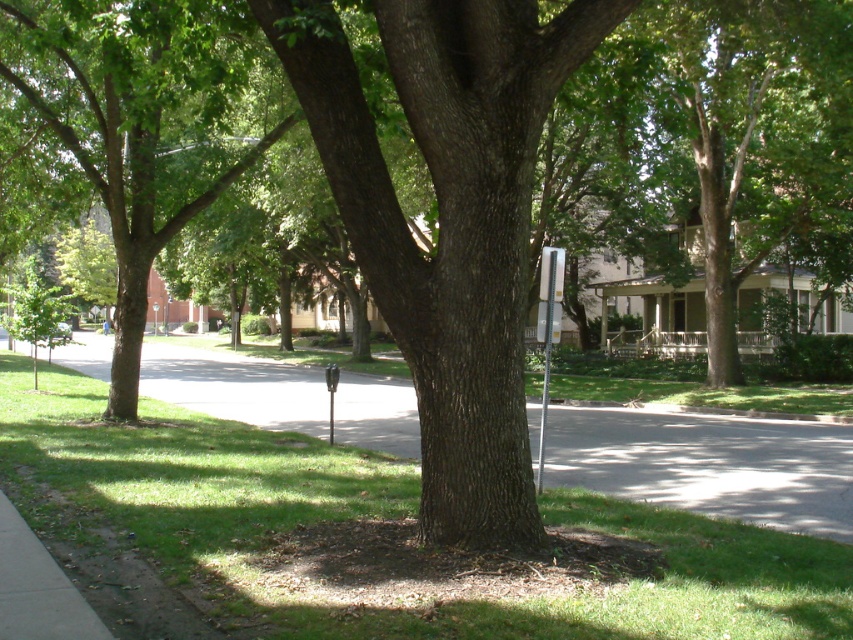
Does gray asphalt pavement at center have a larger size compared to silver metallic parking sign at center-right?

Yes, gray asphalt pavement at center is bigger than silver metallic parking sign at center-right.

Does gray asphalt pavement at center have a lesser height compared to silver metallic parking sign at center-right?

Indeed, gray asphalt pavement at center has a lesser height compared to silver metallic parking sign at center-right.

Is point (824, 476) more distant than point (547, 307)?

Yes, point (824, 476) is farther from viewer.

In order to click on gray asphalt pavement at center in this screenshot , I will do `click(709, 465)`.

Can you confirm if green leafy tree at center is thinner than silver metallic parking sign at center-right?

No, green leafy tree at center is not thinner than silver metallic parking sign at center-right.

Is green leafy tree at center smaller than silver metallic parking sign at center-right?

Actually, green leafy tree at center might be larger than silver metallic parking sign at center-right.

At what (x,y) coordinates should I click in order to perform the action: click on green leafy tree at center. Please return your answer as a coordinate pair (x, y). Looking at the image, I should click on (138, 122).

Identify the location of green leafy tree at center. (138, 122).

Who is lower down, smooth brown tree trunk at center or gray asphalt pavement at center?

Positioned lower is gray asphalt pavement at center.

Does point (454, 80) lie behind point (360, 400)?

No, (454, 80) is closer to viewer.

In order to click on smooth brown tree trunk at center in this screenshot , I will do `click(448, 220)`.